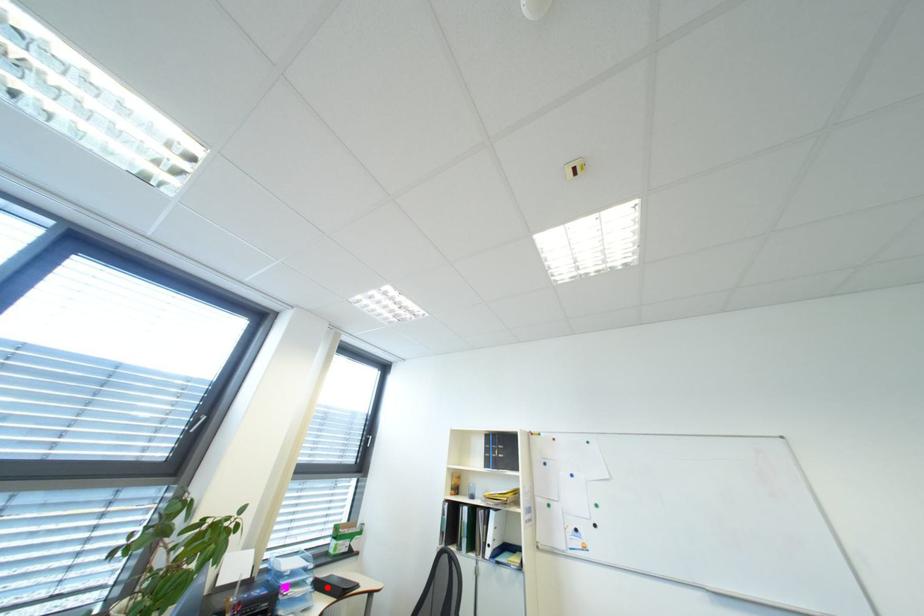
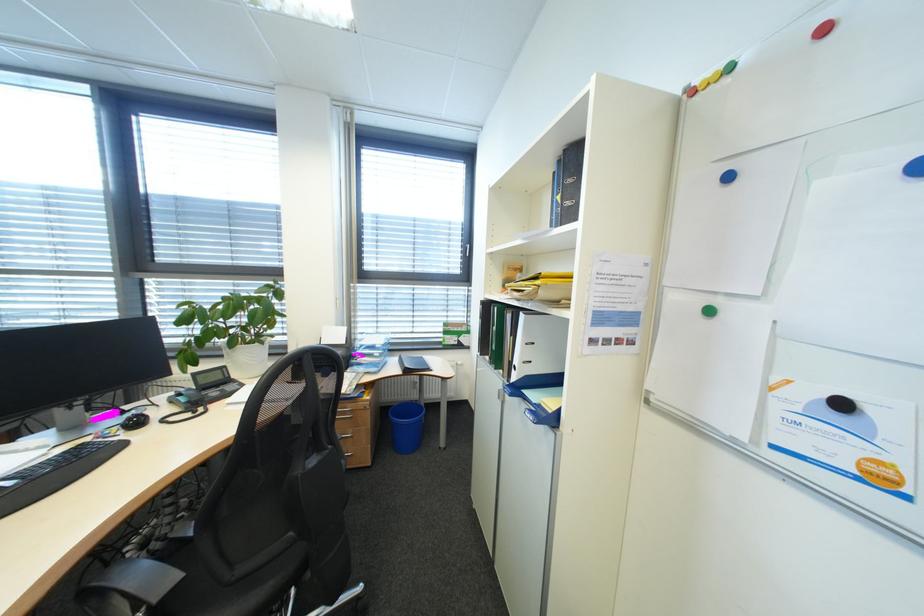
Locate, in the second image, the point that corresponds to the highlighted location in the first image.

(411, 362)